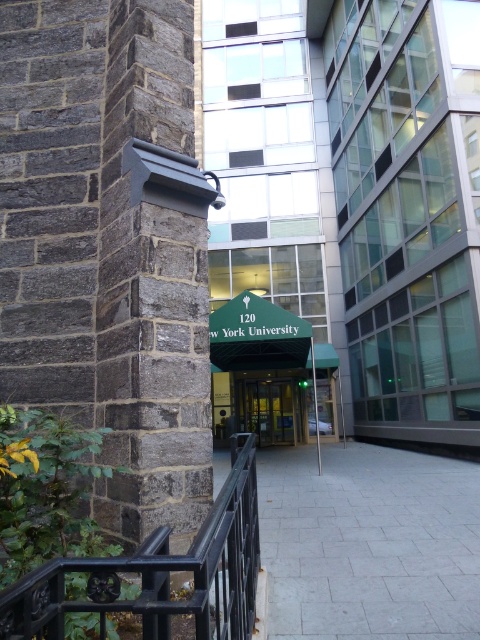
Question: Does gray stone pavement at center appear on the right side of black wrought iron at center?

Choices:
 (A) no
 (B) yes

Answer: (B)

Question: Does gray stone pavement at center appear over black wrought iron at center?

Choices:
 (A) no
 (B) yes

Answer: (A)

Question: Which point is farther to the camera?

Choices:
 (A) (453, 504)
 (B) (248, 460)

Answer: (A)

Question: Does gray stone pavement at center have a smaller size compared to green fabric entrance at center?

Choices:
 (A) no
 (B) yes

Answer: (A)

Question: Which point is farther to the camera?

Choices:
 (A) (431, 490)
 (B) (51, 586)
 (C) (179, 188)
 (D) (271, 381)

Answer: (D)

Question: Which of the following is the farthest from the observer?

Choices:
 (A) (136, 355)
 (B) (320, 589)
 (C) (289, 420)
 (D) (250, 444)

Answer: (C)